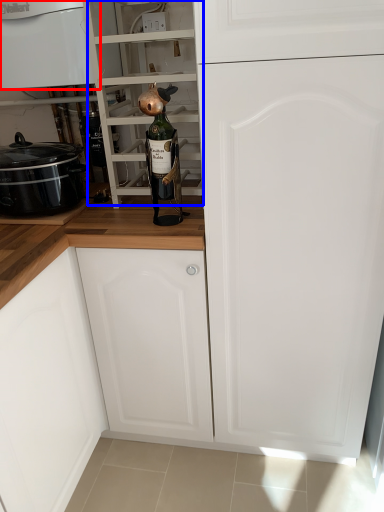
Question: Which of the following is the farthest to the observer, home appliance (highlighted by a red box) or shelf (highlighted by a blue box)?

Choices:
 (A) home appliance
 (B) shelf

Answer: (A)